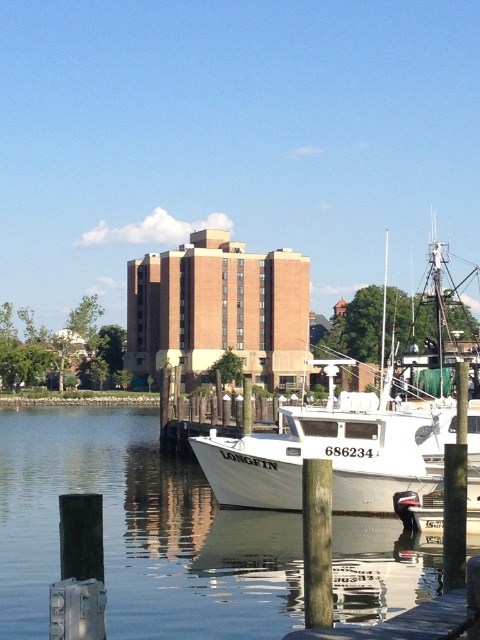
You are standing at the dock and want to check the water clarity at point (139, 532). Is the water clear at that location?

The water at point 0.830, 0.290 is clear.

You are standing on the dock and see the clear water at lower center and the white matte boat at center. Which object is positioned lower in the scene?

The clear water at lower center is located below the white matte boat at center, so it is positioned lower in the scene.

You are a fisherman standing on the dock and want to navigate your boat from the wooden at lower right to the clear water at lower center. Can your boat pass through the space between them?

The clear water at lower center is wider than the wooden at lower right, so your boat can pass through the space between them.